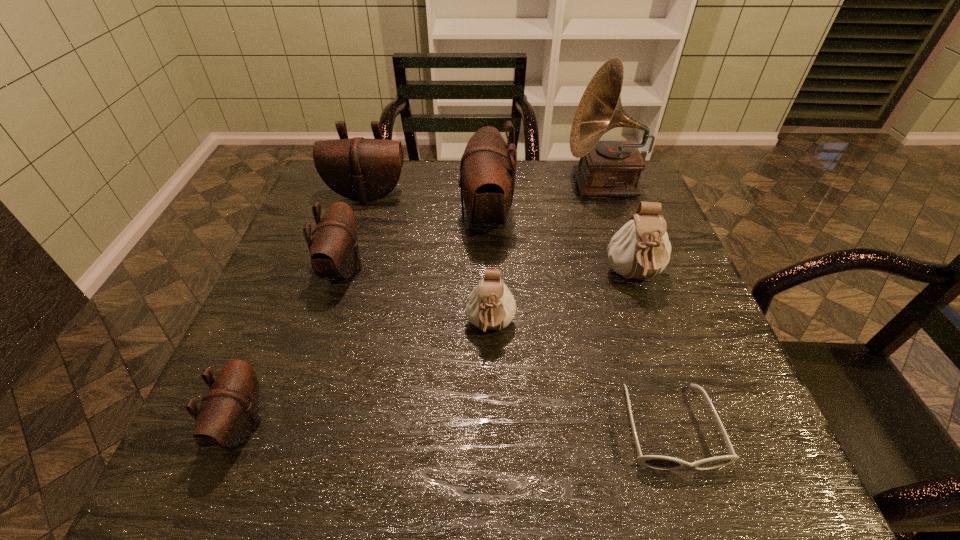
Point out which brown pouch is positioned as the third nearest to the tallest object. Please provide its 2D coordinates. Your answer should be formatted as a tuple, i.e. [(x, y)], where the tuple contains the x and y coordinates of a point satisfying the conditions above.

[(334, 252)]

Identify the location of brown pouch identified as the closest to the nearest brown pouch. This screenshot has height=540, width=960. (334, 252).

You are a GUI agent. You are given a task and a screenshot of the screen. Output one action in this format:
    pyautogui.click(x=<x>, y=<y>)
    Task: Click on the free space that satisfies the following two spatial constraints: 1. with the flap open on the second biggest brown pouch; 2. with the flap open on the second smallest brown pouch
    The image size is (960, 540).
    Given the screenshot: What is the action you would take?
    pyautogui.click(x=345, y=269)

Identify the location of vacant space that satisfies the following two spatial constraints: 1. on the horn of the phonograph record; 2. on the front-facing side of the rightmost pouch. The width and height of the screenshot is (960, 540). (637, 278).

Identify the location of free location that satisfies the following two spatial constraints: 1. on the horn of the phonograph record; 2. with the flap open on the third smallest brown pouch. The image size is (960, 540). (608, 195).

This screenshot has height=540, width=960. In order to click on vacant point that satisfies the following two spatial constraints: 1. on the horn of the brown phonograph record; 2. with the flap open on the second biggest brown pouch in this screenshot , I will do `click(608, 195)`.

This screenshot has height=540, width=960. In order to click on free spot that satisfies the following two spatial constraints: 1. with the flap open on the third smallest brown pouch; 2. with the flap open on the second smallest brown pouch in this screenshot , I will do `click(345, 269)`.

The width and height of the screenshot is (960, 540). Identify the location of vacant point that satisfies the following two spatial constraints: 1. on the horn of the brown phonograph record; 2. with the flap open on the third smallest brown pouch. (608, 195).